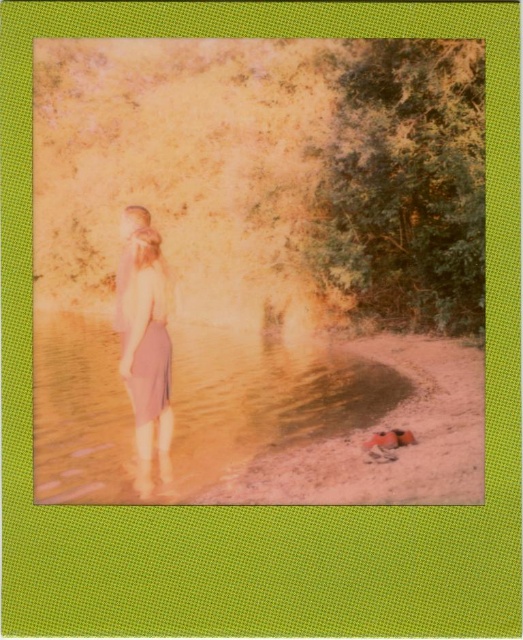
You are a photographer planning to take a photo of the pink satin dress at center and the translucent sand at lower center. Which object should you focus on first if you want to capture both in a single frame without moving the camera?

You should focus on the pink satin dress at center first because the translucent sand at lower center is wider than the pink satin dress at center, so adjusting focus to the dress ensures both can fit within the frame.